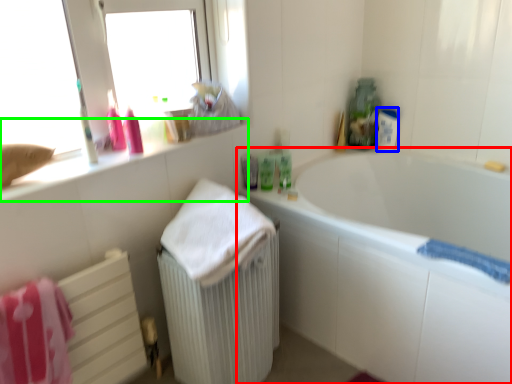
Question: Estimate the real-world distances between objects in this image. Which object is farther from bathtub (highlighted by a red box), toiletry (highlighted by a blue box) or counter top (highlighted by a green box)?

Choices:
 (A) toiletry
 (B) counter top

Answer: (B)